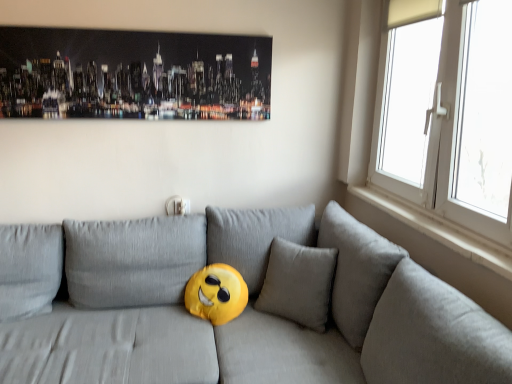
Question: Does metallic cityscape art at upper center appear on the left side of white plastic window at right?

Choices:
 (A) yes
 (B) no

Answer: (A)

Question: From a real-world perspective, is metallic cityscape art at upper center positioned under white plastic window at right based on gravity?

Choices:
 (A) yes
 (B) no

Answer: (B)

Question: Is metallic cityscape art at upper center wider than white plastic window at right?

Choices:
 (A) yes
 (B) no

Answer: (B)

Question: Is metallic cityscape art at upper center further to the viewer compared to white plastic window at right?

Choices:
 (A) no
 (B) yes

Answer: (B)

Question: Can you confirm if metallic cityscape art at upper center is smaller than white plastic window at right?

Choices:
 (A) yes
 (B) no

Answer: (A)

Question: In terms of height, does white smooth window sill at right look taller or shorter compared to matte gray couch at center?

Choices:
 (A) tall
 (B) short

Answer: (B)

Question: Is point (487, 259) closer or farther from the camera than point (270, 254)?

Choices:
 (A) closer
 (B) farther

Answer: (A)

Question: From a real-world perspective, is white smooth window sill at right physically located above or below matte gray couch at center?

Choices:
 (A) above
 (B) below

Answer: (A)

Question: Based on their sizes in the image, would you say white smooth window sill at right is bigger or smaller than matte gray couch at center?

Choices:
 (A) small
 (B) big

Answer: (A)

Question: Considering the positions of metallic cityscape art at upper center and white plastic window at right in the image, is metallic cityscape art at upper center wider or thinner than white plastic window at right?

Choices:
 (A) thin
 (B) wide

Answer: (A)

Question: From a real-world perspective, is metallic cityscape art at upper center positioned above or below white plastic window at right?

Choices:
 (A) below
 (B) above

Answer: (B)

Question: Is point (62, 46) positioned closer to the camera than point (509, 177)?

Choices:
 (A) closer
 (B) farther

Answer: (B)

Question: Based on their positions, is metallic cityscape art at upper center located to the left or right of white plastic window at right?

Choices:
 (A) left
 (B) right

Answer: (A)

Question: Considering the relative positions of matte gray couch at center and metallic cityscape art at upper center in the image provided, is matte gray couch at center to the left or to the right of metallic cityscape art at upper center?

Choices:
 (A) left
 (B) right

Answer: (B)

Question: Considering the positions of point (189, 276) and point (117, 41), is point (189, 276) closer or farther from the camera than point (117, 41)?

Choices:
 (A) farther
 (B) closer

Answer: (A)